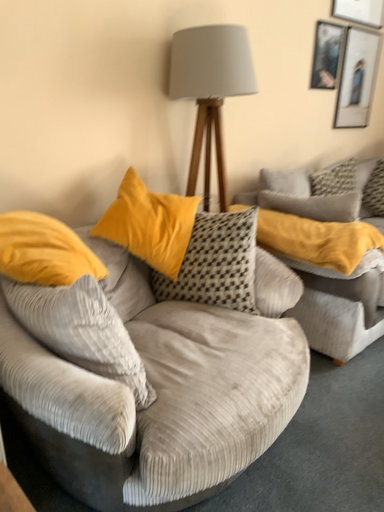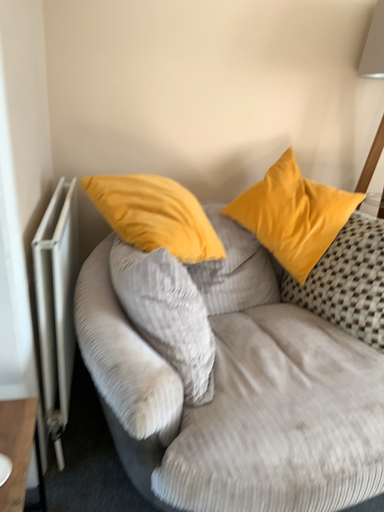
Question: Which way did the camera rotate in the video?

Choices:
 (A) rotated left
 (B) rotated right

Answer: (A)